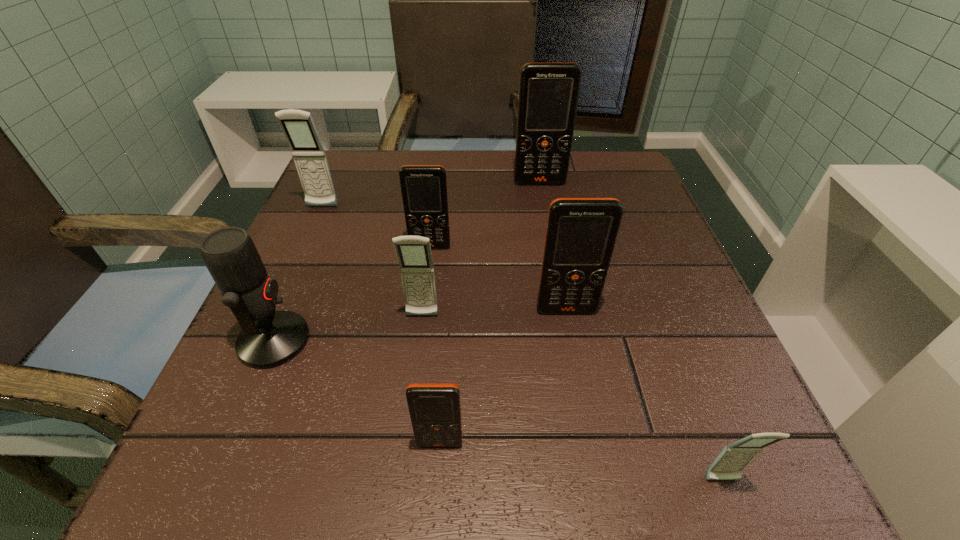
This screenshot has height=540, width=960. In order to click on free space at the near left corner of the desktop in this screenshot , I will do `click(263, 436)`.

In order to click on vacant region between the microphone and the second gray cellular telephone from right to left in this screenshot , I will do `click(348, 328)`.

Locate an element on the screen. This screenshot has height=540, width=960. unoccupied area between the second farthest orange cellular telephone and the red microphone is located at coordinates (352, 294).

Find the location of a particular element. This screenshot has width=960, height=540. empty space between the farthest gray cellular telephone and the red microphone is located at coordinates (299, 274).

The image size is (960, 540). I want to click on vacant area that lies between the second nearest orange cellular telephone and the second smallest gray cellular telephone, so click(494, 313).

Find the location of a particular element. vacant area between the tallest cellular telephone and the second biggest gray cellular telephone is located at coordinates (481, 249).

Locate an element on the screen. This screenshot has height=540, width=960. vacant region between the nearest cellular telephone and the second biggest gray cellular telephone is located at coordinates (572, 399).

At what (x,y) coordinates should I click in order to perform the action: click on empty space between the leftmost gray cellular telephone and the second nearest gray cellular telephone. Please return your answer as a coordinate pair (x, y). The height and width of the screenshot is (540, 960). Looking at the image, I should click on (372, 262).

Where is `vacant space that's between the rightmost object and the second biggest gray cellular telephone`? vacant space that's between the rightmost object and the second biggest gray cellular telephone is located at coordinates (572, 399).

Find the location of a particular element. This screenshot has height=540, width=960. the closest object relative to the second farthest orange cellular telephone is located at coordinates (414, 255).